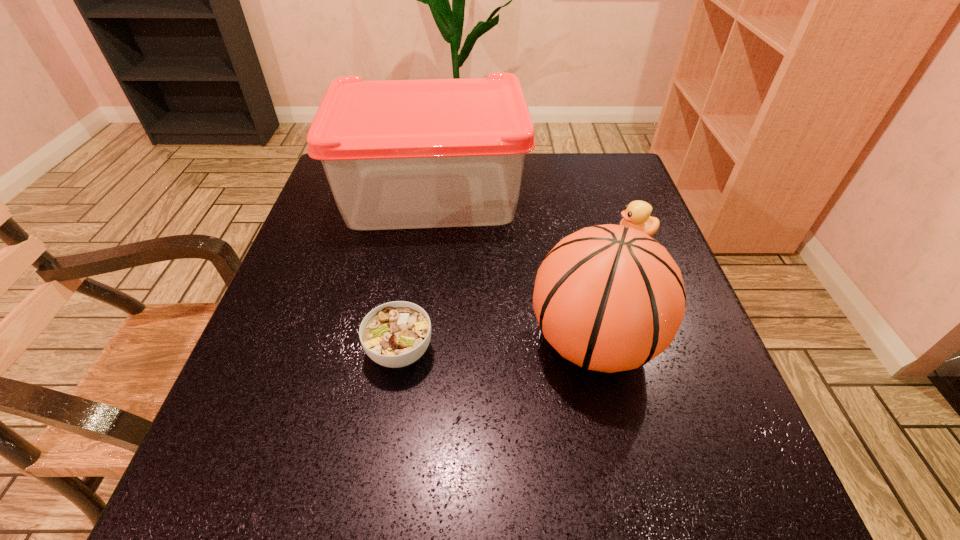
Where is `free space between the basketball and the tray`? Image resolution: width=960 pixels, height=540 pixels. free space between the basketball and the tray is located at coordinates (513, 268).

You are a GUI agent. You are given a task and a screenshot of the screen. Output one action in this format:
    pyautogui.click(x=<x>, y=<y>)
    Task: Click on the object that is the third closest to the basketball
    The width and height of the screenshot is (960, 540).
    Given the screenshot: What is the action you would take?
    pyautogui.click(x=395, y=334)

Point out which object is positioned as the third nearest to the duckling. Please provide its 2D coordinates. Your answer should be formatted as a tuple, i.e. [(x, y)], where the tuple contains the x and y coordinates of a point satisfying the conditions above.

[(395, 334)]

In order to click on free spot that satisfies the following two spatial constraints: 1. on the face of the duckling; 2. on the front side of the basketball in this screenshot , I will do `click(677, 342)`.